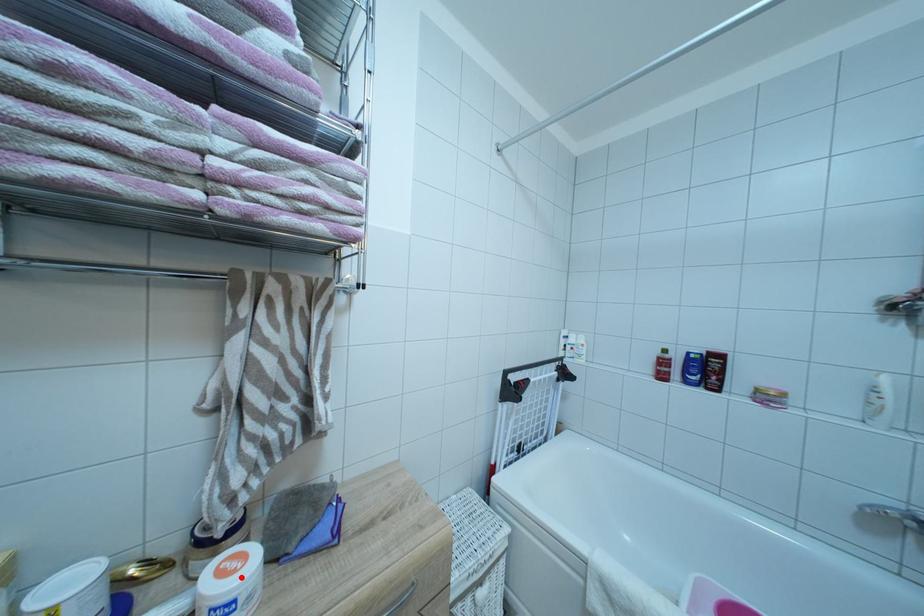
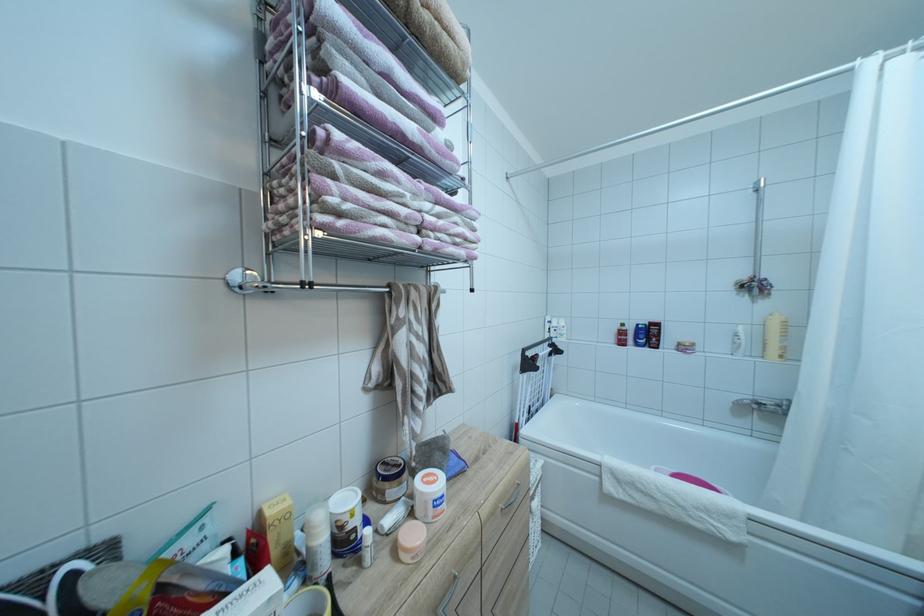
The point at the highlighted location is marked in the first image. Where is the corresponding point in the second image?

(442, 487)